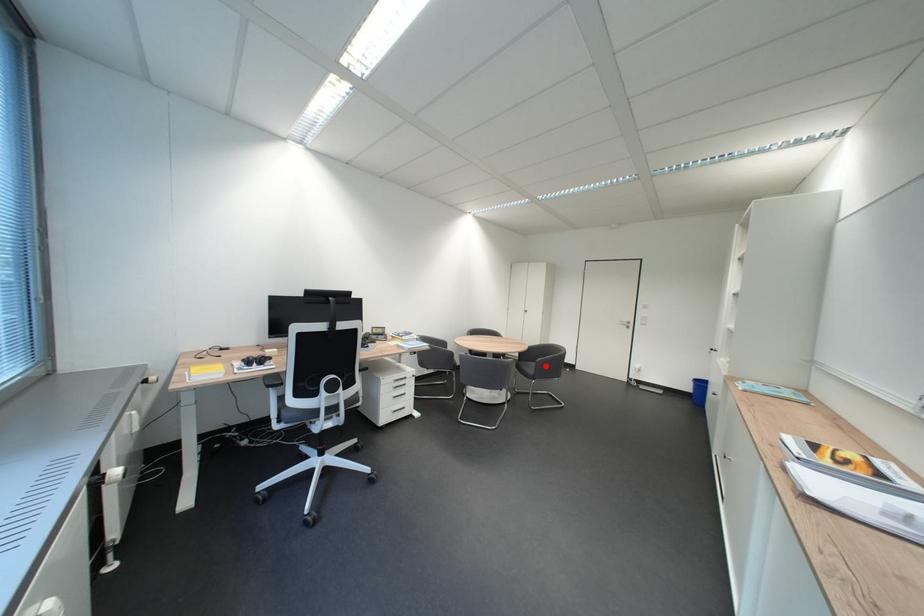
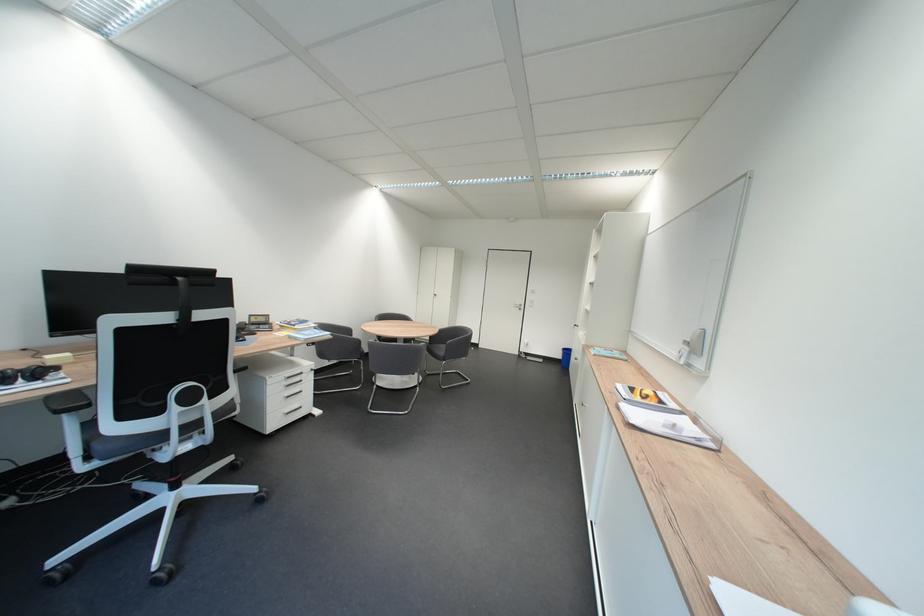
Find the pixel in the second image that matches the highlighted location in the first image.

(456, 347)